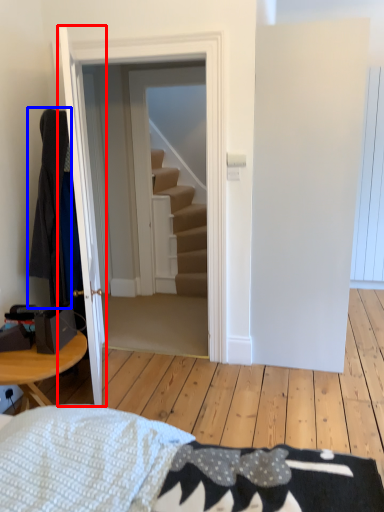
Question: Which of the following is the farthest to the observer, door (highlighted by a red box) or robe (highlighted by a blue box)?

Choices:
 (A) door
 (B) robe

Answer: (B)